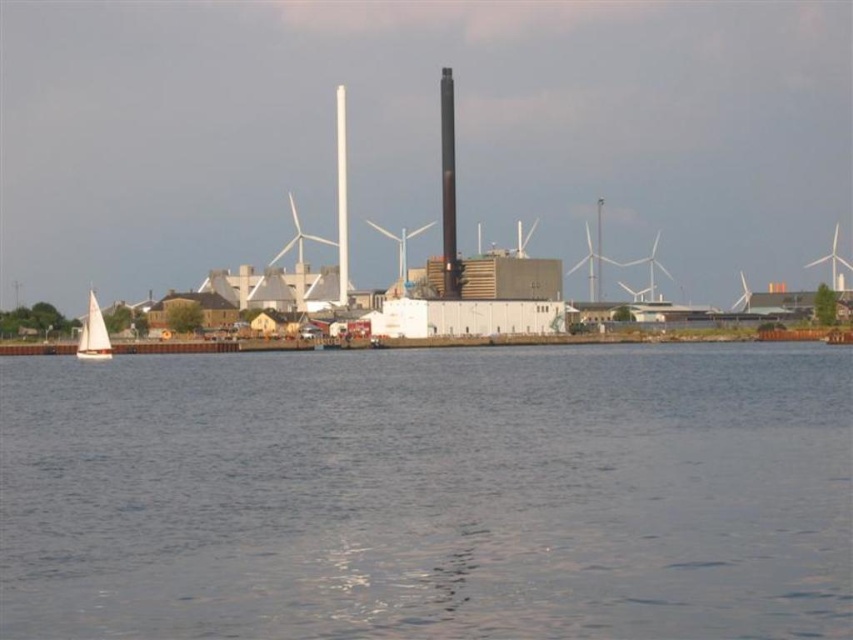
Question: Among these points, which one is nearest to the camera?

Choices:
 (A) (840, 289)
 (B) (578, 497)
 (C) (86, 353)

Answer: (B)

Question: Which of the following is the closest to the observer?

Choices:
 (A) white sailboat at left
 (B) white plastic windmill at center

Answer: (A)

Question: From the image, what is the correct spatial relationship of white sailboat at left in relation to white plastic windmill at center?

Choices:
 (A) left
 (B) right

Answer: (A)

Question: Considering the relative positions of white sailboat at left and white plastic windmill at upper right in the image provided, where is white sailboat at left located with respect to white plastic windmill at upper right?

Choices:
 (A) above
 (B) below

Answer: (B)

Question: Does white plastic windmill at center appear on the left side of white plastic windmill at upper right?

Choices:
 (A) no
 (B) yes

Answer: (B)

Question: Which of the following is the farthest from the observer?

Choices:
 (A) (84, 333)
 (B) (401, 246)
 (C) (247, 365)

Answer: (B)